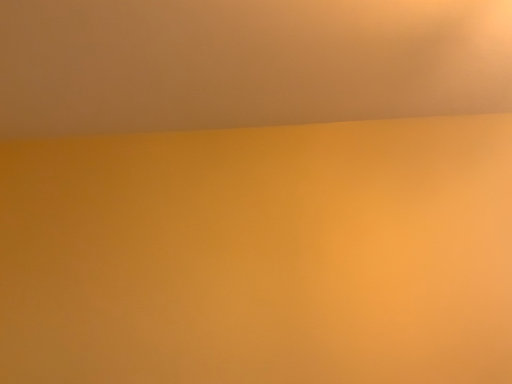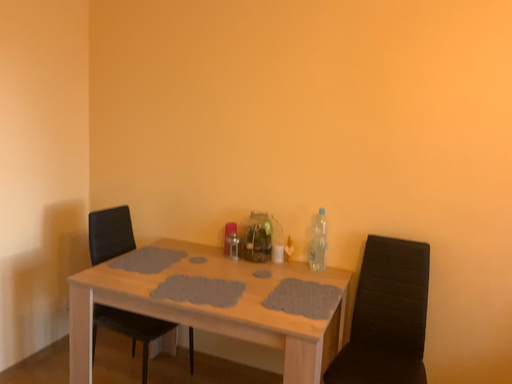
Question: How did the camera likely rotate when shooting the video?

Choices:
 (A) rotated right
 (B) rotated left

Answer: (B)